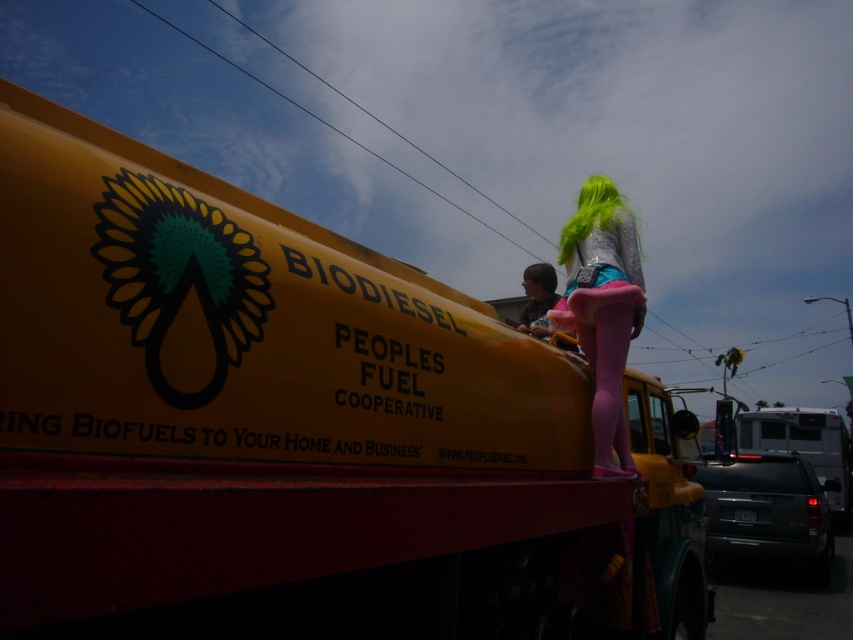
You are a pedestrian looking at the yellow matte truck at upper center and the neon green hair at upper center in the image. Which object is located higher up?

The neon green hair at upper center is higher up because the yellow matte truck at upper center is positioned under it.

You are a photographer trying to capture both the neon green hair at upper center and the matte brown hair at center in a single shot. Based on their sizes in the image, which hair color would appear closer to the camera?

The neon green hair at upper center appears closer to the camera because it is larger in size than the matte brown hair at center.